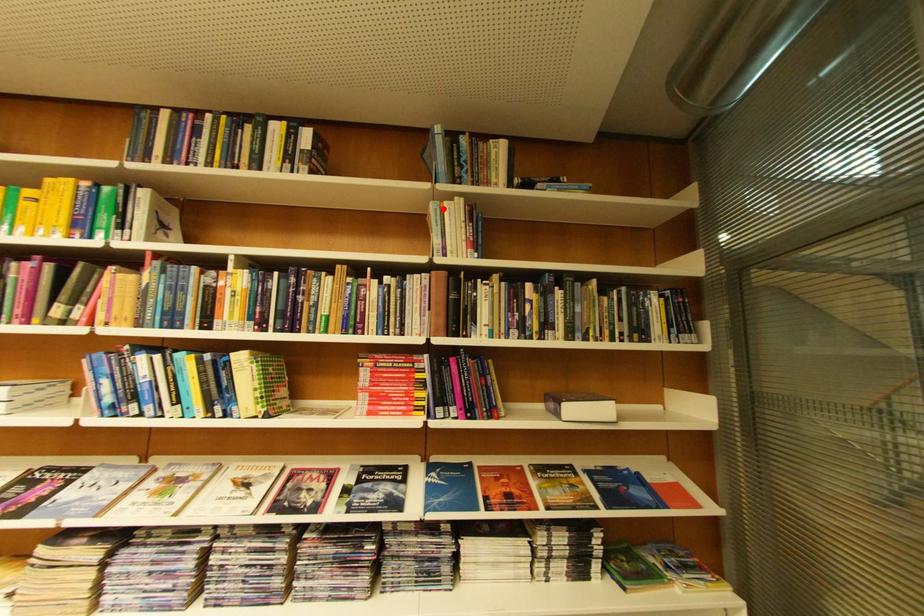
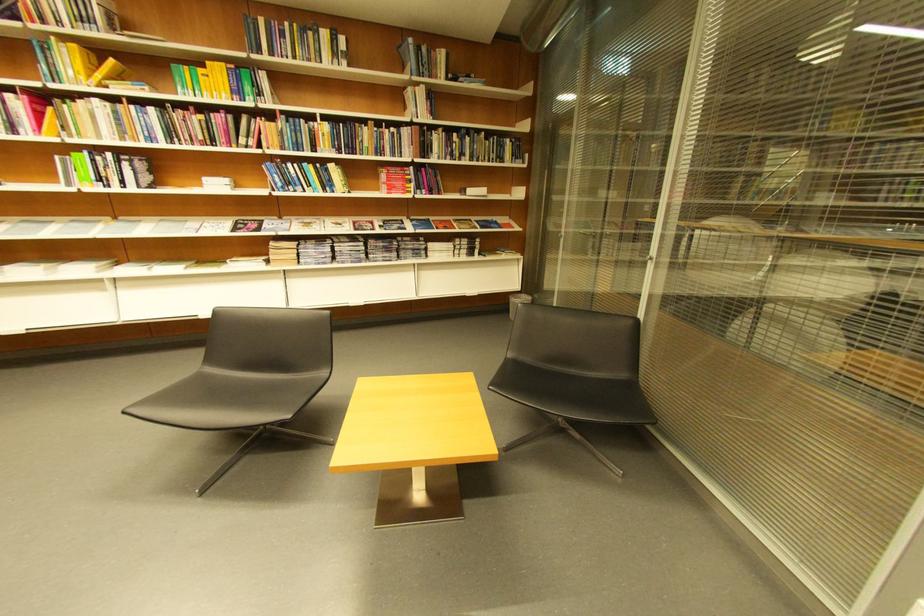
Question: I am providing you with two images of the same scene from different viewpoints. A red point is marked on the first image. Can you still see the location of the red point in image 2?

Choices:
 (A) Yes
 (B) No

Answer: (A)